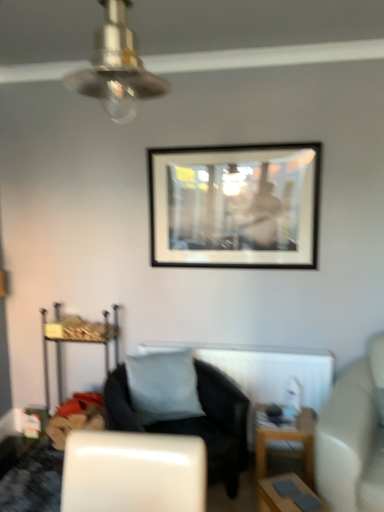
This screenshot has height=512, width=384. What are the coordinates of `blank area beneath black matte picture frame at upper center (from a real-world perspective)` in the screenshot? It's located at (223, 340).